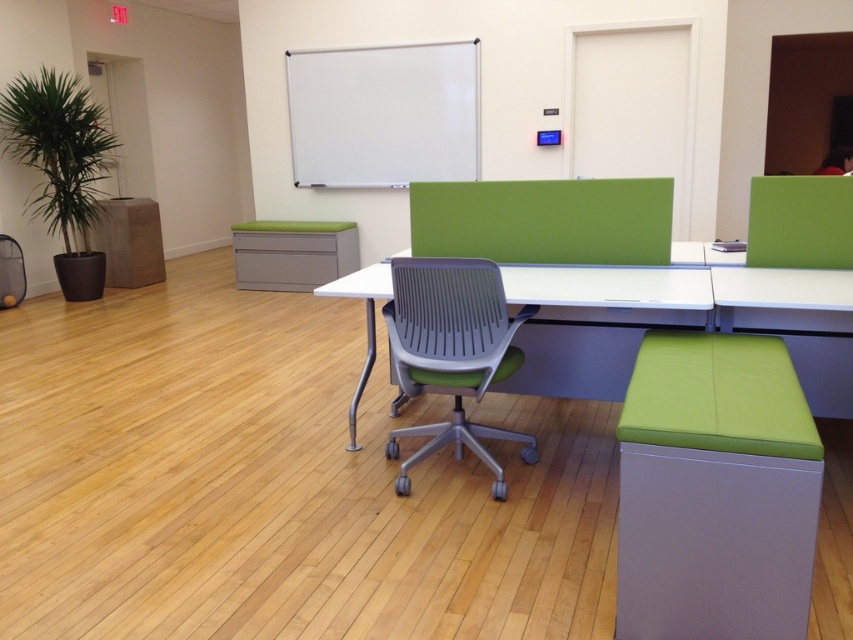
Between point (819, 440) and point (605, 276), which one is positioned behind?

The point (605, 276) is more distant.

Find the location of `green fabric stool at lower right`. green fabric stool at lower right is located at coordinates (715, 492).

Is gray plastic swivel chair at center to the left of white plastic table at center from the viewer's perspective?

Correct, you'll find gray plastic swivel chair at center to the left of white plastic table at center.

Who is more distant from viewer, (527,454) or (578,316)?

The point (578,316) is more distant.

Identify the location of gray plastic swivel chair at center. (451, 352).

Which is above, green fabric stool at lower right or gray plastic swivel chair at center?

gray plastic swivel chair at center is above.

Looking at this image, who is more distant from viewer, (795, 424) or (474, 444)?

The point (474, 444) is more distant.

This screenshot has width=853, height=640. Find the location of `green fabric stool at lower right`. green fabric stool at lower right is located at coordinates (715, 492).